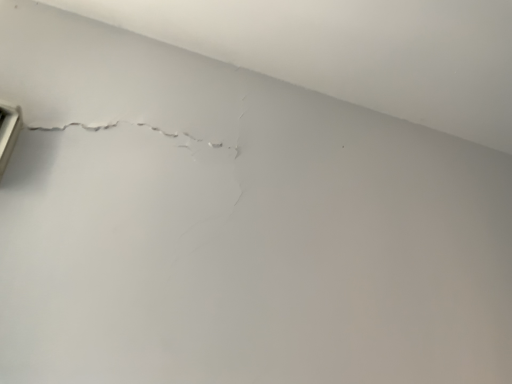
Identify the location of metallic silver window at left. (8, 132).

Describe the element at coordinates (8, 132) in the screenshot. I see `metallic silver window at left` at that location.

Identify the location of metallic silver window at left. This screenshot has width=512, height=384. (8, 132).